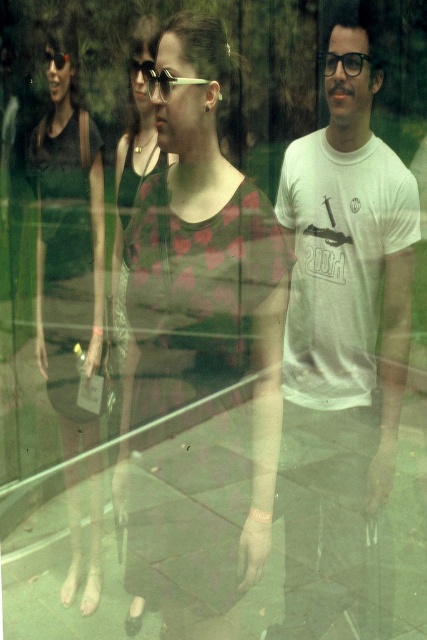
Question: Estimate the real-world distances between objects in this image. Which object is closer to the matte black sunglasses at center?

Choices:
 (A) matte floral dress at center
 (B) matte black dress at left
 (C) white cotton t-shirt at center

Answer: (A)

Question: Which object is farther from the camera taking this photo?

Choices:
 (A) matte black sunglasses at center
 (B) white cotton t-shirt at center
 (C) matte black dress at left

Answer: (C)

Question: Can you confirm if matte floral dress at center is wider than matte black dress at left?

Choices:
 (A) yes
 (B) no

Answer: (A)

Question: Observing the image, what is the correct spatial positioning of white cotton t-shirt at center in reference to matte black dress at left?

Choices:
 (A) right
 (B) left

Answer: (A)

Question: Is white cotton t-shirt at center above matte black dress at left?

Choices:
 (A) no
 (B) yes

Answer: (A)

Question: Estimate the real-world distances between objects in this image. Which object is closer to the matte floral dress at center?

Choices:
 (A) matte black sunglasses at center
 (B) matte black dress at left
 (C) white cotton t-shirt at center

Answer: (C)